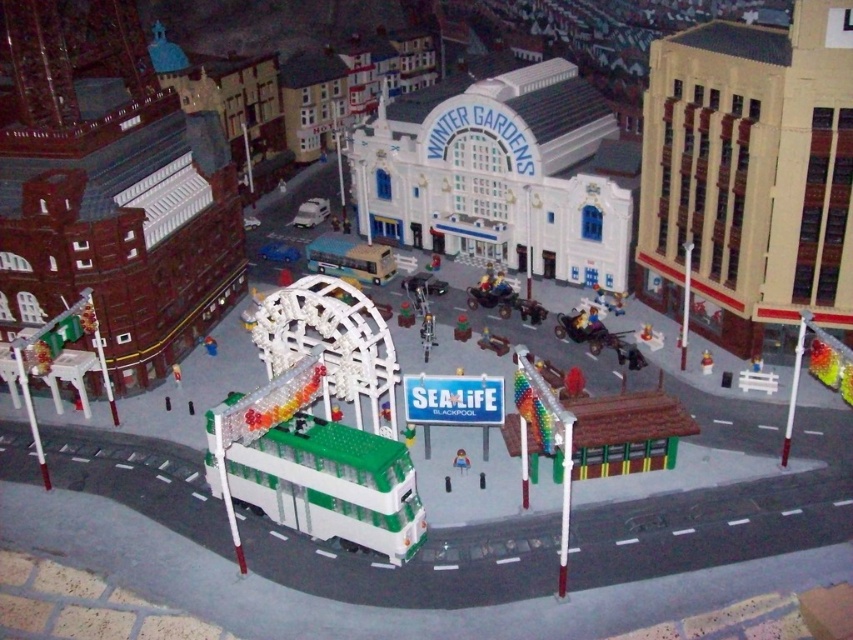
Question: Is metallic silver cart at center thinner than matte yellow toy at center?

Choices:
 (A) no
 (B) yes

Answer: (A)

Question: Can you confirm if white plastic bus at center is wider than green plastic quad bike at center?

Choices:
 (A) no
 (B) yes

Answer: (B)

Question: Among these points, which one is farthest from the camera?

Choices:
 (A) (492, 280)
 (B) (390, 264)
 (C) (703, 358)

Answer: (B)

Question: Which is farther from the metallic silver cart at center?

Choices:
 (A) green plastic bus at center
 (B) green plastic toy at center
 (C) matte yellow toy at center

Answer: (B)

Question: Is white plastic bus at center positioned in front of metallic silver cart at center?

Choices:
 (A) yes
 (B) no

Answer: (A)

Question: Which object appears farthest from the camera in this image?

Choices:
 (A) matte yellow toy at center
 (B) green plastic quad bike at center

Answer: (B)